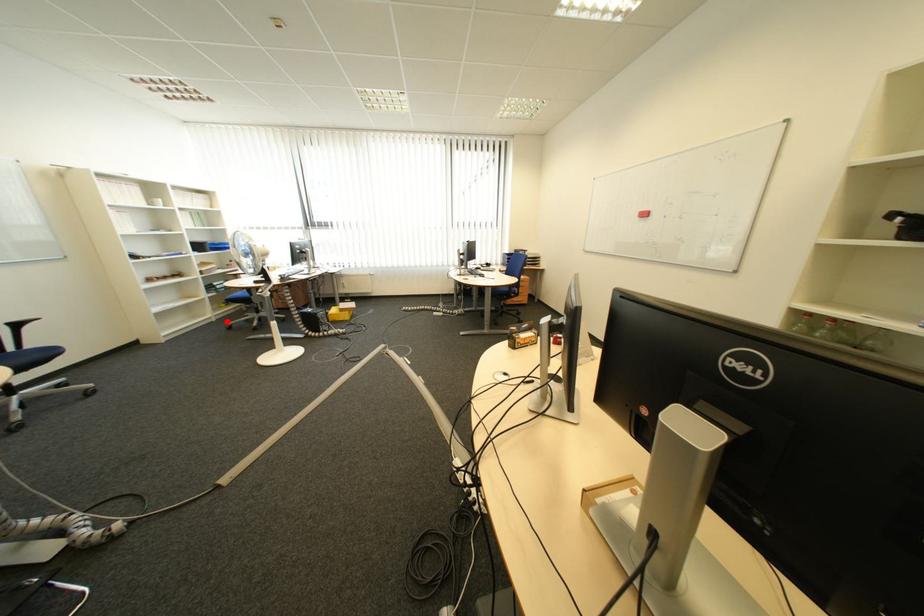
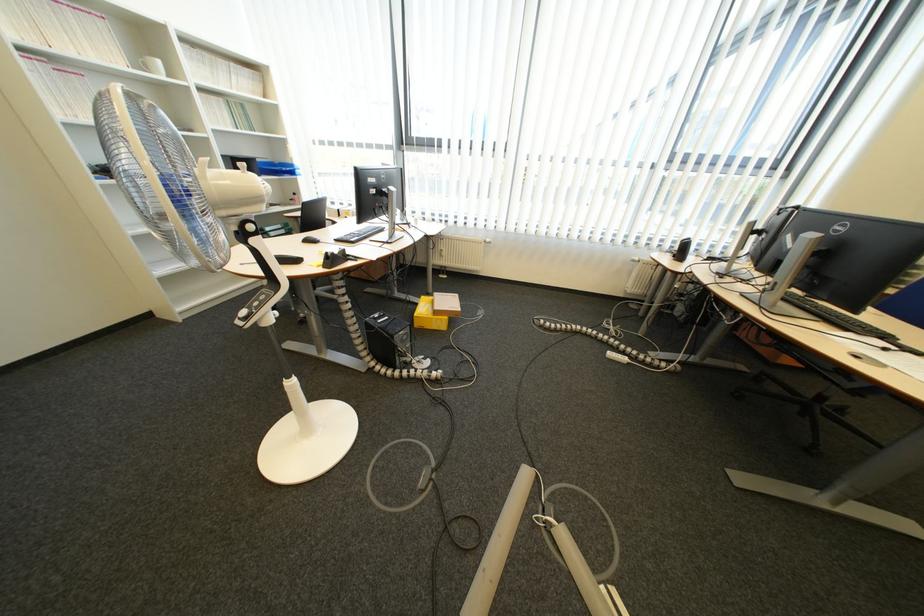
The point at the highlighted location is marked in the first image. Where is the corresponding point in the second image?

(277, 285)